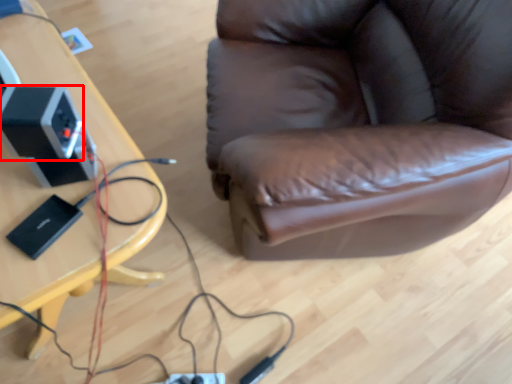
Question: Where is speaker (annotated by the red box) located in relation to table in the image?

Choices:
 (A) left
 (B) right

Answer: (B)